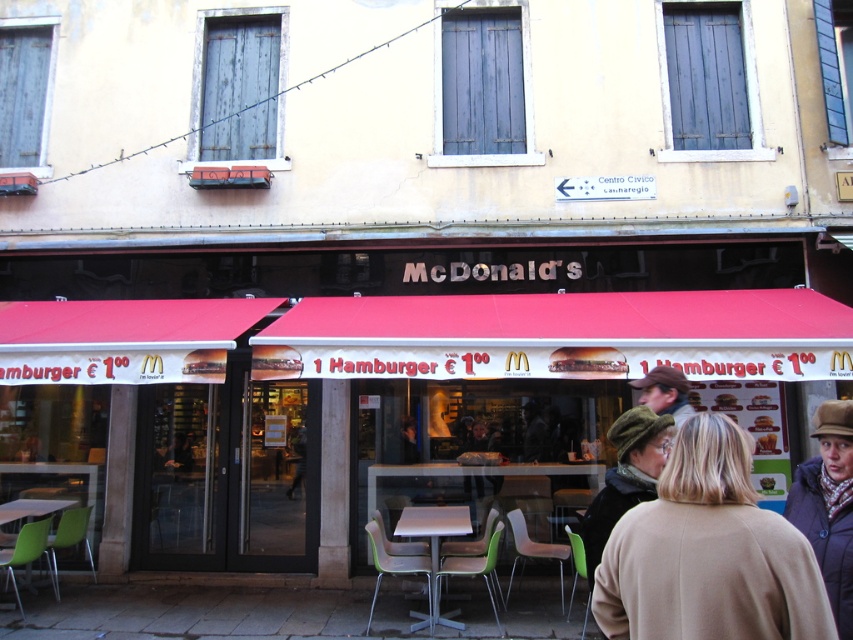
Question: Among these objects, which one is farthest from the camera?

Choices:
 (A) green felt hat at center
 (B) light brown woolen hat at center
 (C) metallic gray table at center

Answer: (C)

Question: Is brown woolen hat at upper right in front of green plastic table at lower left?

Choices:
 (A) no
 (B) yes

Answer: (B)

Question: Which object is farther from the camera taking this photo?

Choices:
 (A) metallic gray table at center
 (B) green felt hat at center
 (C) matte red awning at center

Answer: (A)

Question: Is light brown woolen hat at center further to the viewer compared to green plastic table at lower left?

Choices:
 (A) yes
 (B) no

Answer: (B)

Question: Which point is farther to the camera?

Choices:
 (A) (438, 566)
 (B) (656, 401)
 (C) (44, 499)
 (D) (833, 488)

Answer: (C)

Question: Does brown woolen hat at upper right have a smaller size compared to green felt hat at center?

Choices:
 (A) yes
 (B) no

Answer: (A)